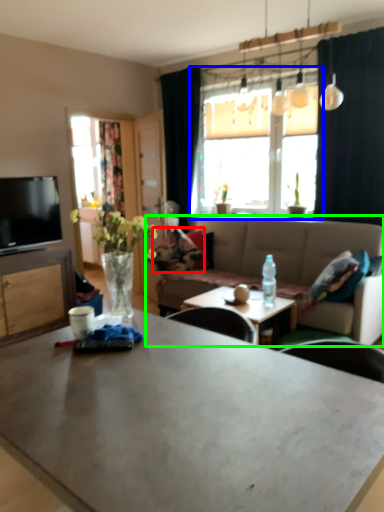
Question: Which object is the closest to the pillow (highlighted by a red box)? Choose among these: window (highlighted by a blue box) or studio couch (highlighted by a green box).

Choices:
 (A) window
 (B) studio couch

Answer: (B)